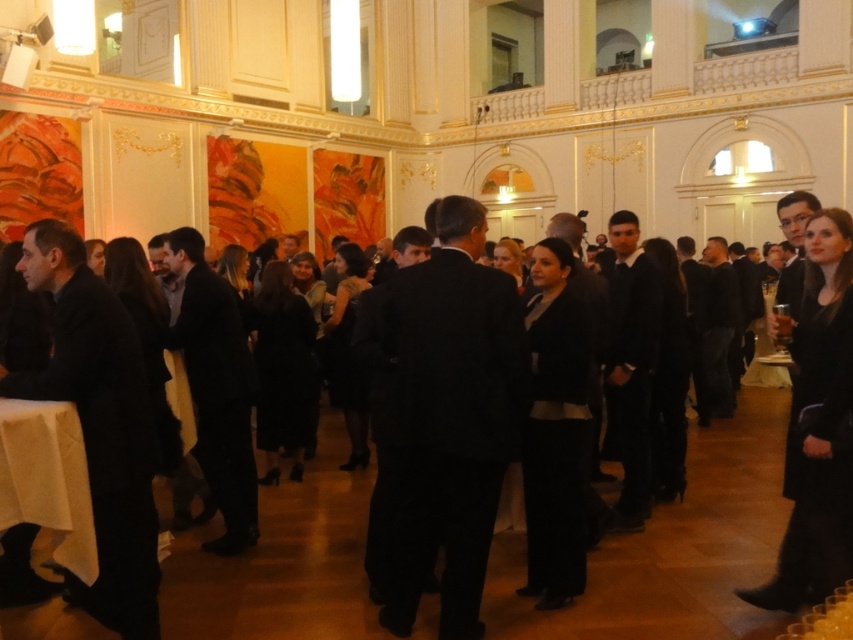
Question: Can you confirm if black wool coat at right is wider than white cloth at lower left?

Choices:
 (A) yes
 (B) no

Answer: (A)

Question: Is black wool coat at right further to camera compared to white cloth at lower left?

Choices:
 (A) no
 (B) yes

Answer: (B)

Question: Which point is farther from the camera taking this photo?

Choices:
 (A) (9, 408)
 (B) (851, 305)

Answer: (B)

Question: Among these points, which one is farthest from the camera?

Choices:
 (A) (44, 426)
 (B) (802, 392)

Answer: (B)

Question: Is black wool coat at right above white cloth at lower left?

Choices:
 (A) no
 (B) yes

Answer: (B)